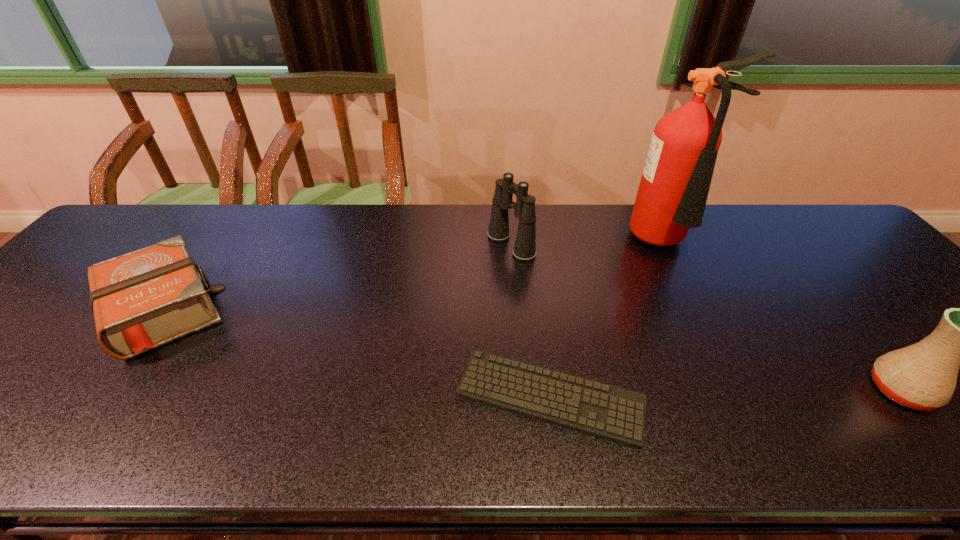
The image size is (960, 540). I want to click on vacant space located on the front of the leftmost object, so click(77, 429).

The width and height of the screenshot is (960, 540). In order to click on vacant region located 0.220m on the back of the computer keyboard in this screenshot , I will do `click(536, 287)`.

Locate an element on the screen. The width and height of the screenshot is (960, 540). fire extinguisher at the far edge is located at coordinates (672, 194).

This screenshot has height=540, width=960. I want to click on binoculars that is at the far edge, so click(524, 249).

Where is `pottery that is at the near edge`? pottery that is at the near edge is located at coordinates (923, 376).

The width and height of the screenshot is (960, 540). Find the location of `computer keyboard at the near edge`. computer keyboard at the near edge is located at coordinates (615, 414).

Find the location of a particular element. The height and width of the screenshot is (540, 960). object at the left edge is located at coordinates (141, 300).

The height and width of the screenshot is (540, 960). I want to click on vacant space at the far edge, so click(595, 237).

At what (x,y) coordinates should I click in order to perform the action: click on free space at the near edge. Please return your answer as a coordinate pair (x, y). The image size is (960, 540). Looking at the image, I should click on (495, 427).

Identify the location of vacant space at the left edge. Image resolution: width=960 pixels, height=540 pixels. (26, 329).